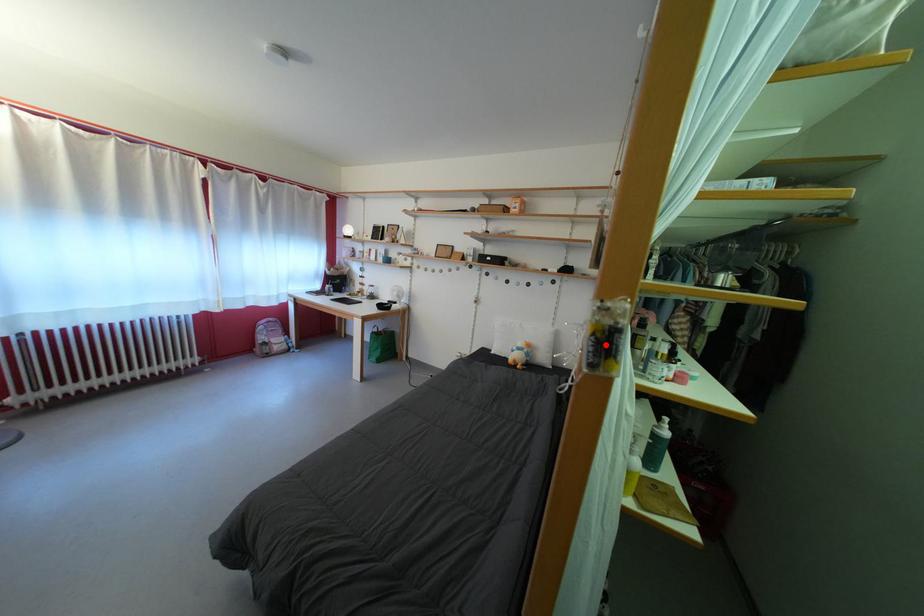
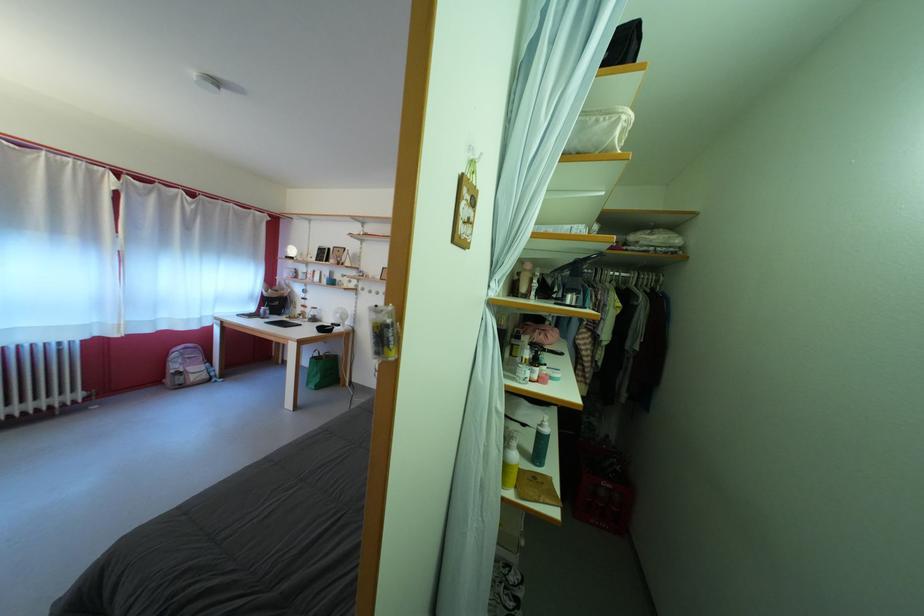
The point at the highlighted location is marked in the first image. Where is the corresponding point in the second image?

(383, 339)